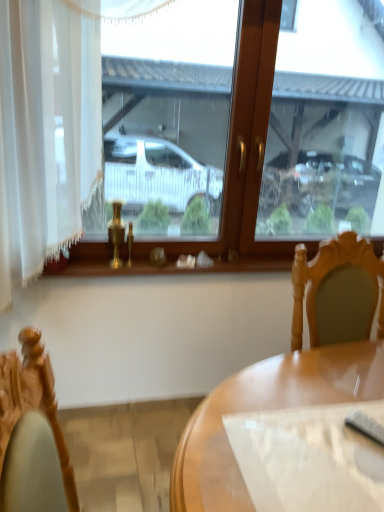
The image size is (384, 512). What do you see at coordinates (234, 132) in the screenshot? I see `wooden frame at center` at bounding box center [234, 132].

Identify the location of wooden frame at center. This screenshot has width=384, height=512. (234, 132).

Measure the distance between point (363, 28) and camera.

A distance of 7.11 feet exists between point (363, 28) and camera.

Where is `wooden frame at center`? The height and width of the screenshot is (512, 384). wooden frame at center is located at coordinates (234, 132).